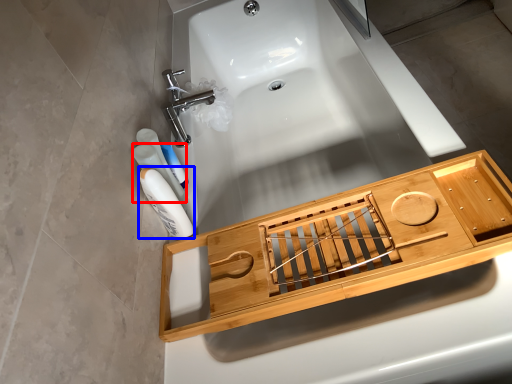
Question: Which of the following is the closest to the observer, mouthwash (highlighted by a red box) or mouthwash (highlighted by a blue box)?

Choices:
 (A) mouthwash
 (B) mouthwash

Answer: (B)